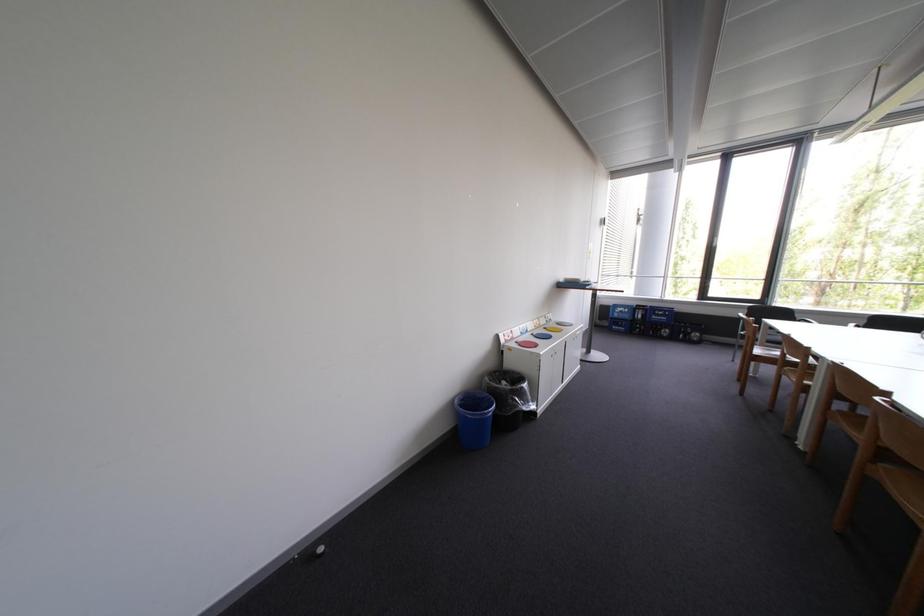
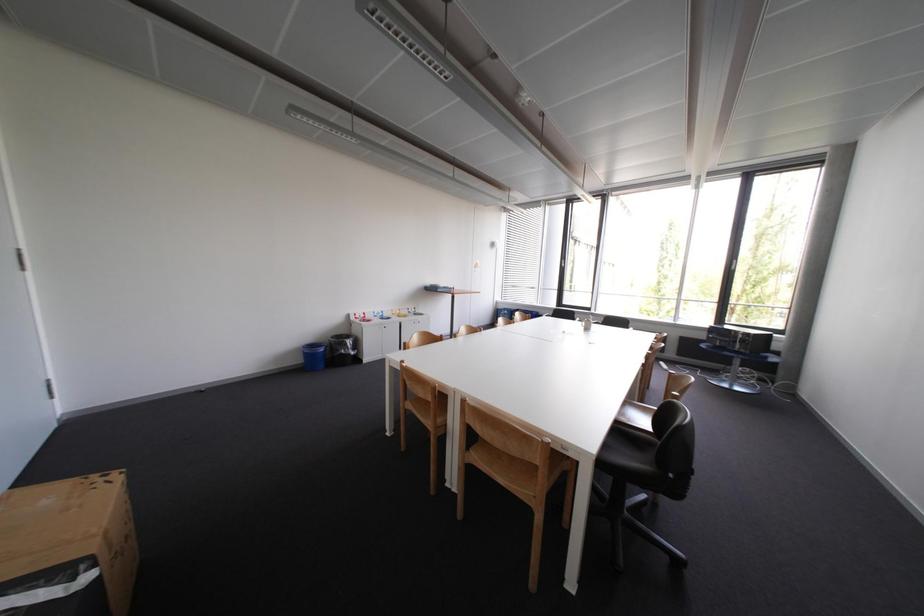
In a continuous first-person perspective shot, in which direction is the camera moving?

The cameraman walked toward right, backward.